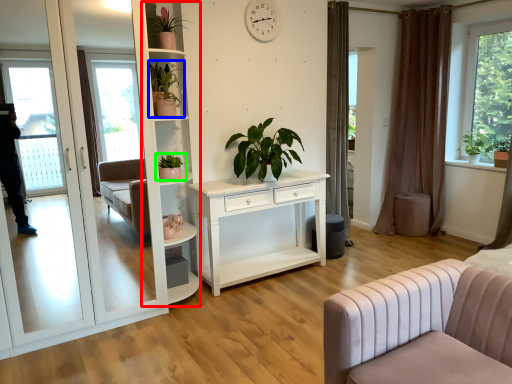
Question: Which is nearer to the bookshelf (highlighted by a red box)? houseplant (highlighted by a blue box) or houseplant (highlighted by a green box).

Choices:
 (A) houseplant
 (B) houseplant

Answer: (A)